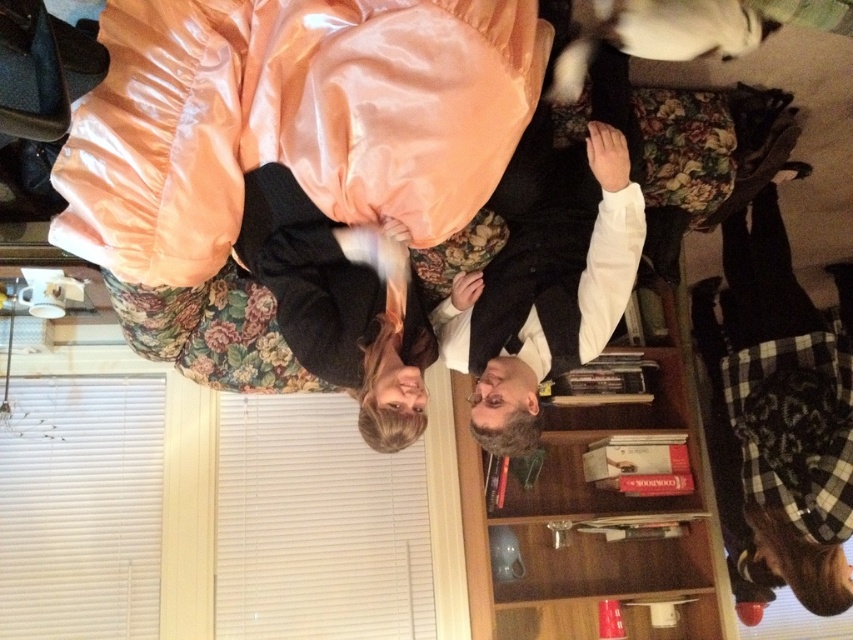
You are standing in a rotated living room scene. You see a point marked at coordinates [289,120]. Which object is this point located on?

The point at coordinates [289,120] is located on the silky peach sleeping bag at upper left.

You are trying to reach the wooden bookshelf at center from the silky peach sleeping bag at upper left. Since the image is rotated, which direction should you move in to get there?

The silky peach sleeping bag at upper left is positioned over the wooden bookshelf at center. Since the image is rotated 90 degrees clockwise, moving downward would actually take you towards the wooden bookshelf at center.

You are organizing a storage space and need to decide which item to place on a narrow shelf that can only hold items up to 10 cm in thickness. Based on the image, which item between the silky peach sleeping bag at upper left and the wooden bookshelf at center would fit better?

The silky peach sleeping bag at upper left is thinner than the wooden bookshelf at center, so it would fit better on the narrow shelf that can only hold items up to 10 cm in thickness.